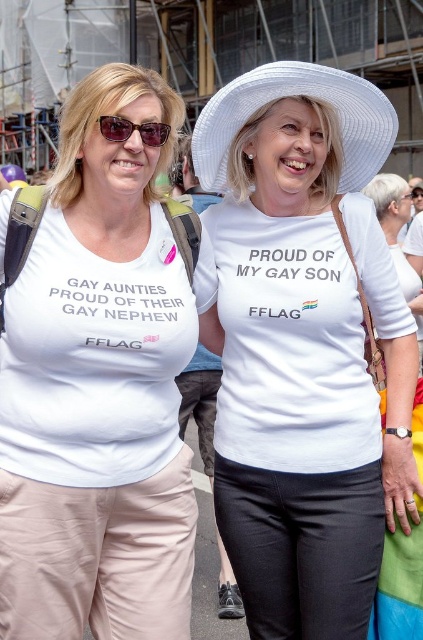
Who is shorter, white cotton shirt at center or white matte t-shirt at left?

white cotton shirt at center

Locate an element on the screen. white cotton shirt at center is located at coordinates (304, 348).

At what (x,y) coordinates should I click in order to perform the action: click on white woven hat at upper center. Please return your answer as a coordinate pair (x, y). Looking at the image, I should click on (296, 96).

Is point (214, 145) less distant than point (129, 136)?

That is False.

Locate an element on the screen. This screenshot has height=640, width=423. white woven hat at upper center is located at coordinates (296, 96).

Can you confirm if white cotton shirt at center is positioned below white woven hat at upper center?

No, white cotton shirt at center is not below white woven hat at upper center.

The height and width of the screenshot is (640, 423). Identify the location of white cotton shirt at center. (304, 348).

Is point (274, 106) closer to camera compared to point (285, 64)?

No, (274, 106) is behind (285, 64).

You are a GUI agent. You are given a task and a screenshot of the screen. Output one action in this format:
    pyautogui.click(x=<x>, y=<y>)
    Task: Click on the white cotton shirt at center
    The height and width of the screenshot is (640, 423).
    Given the screenshot: What is the action you would take?
    pyautogui.click(x=304, y=348)